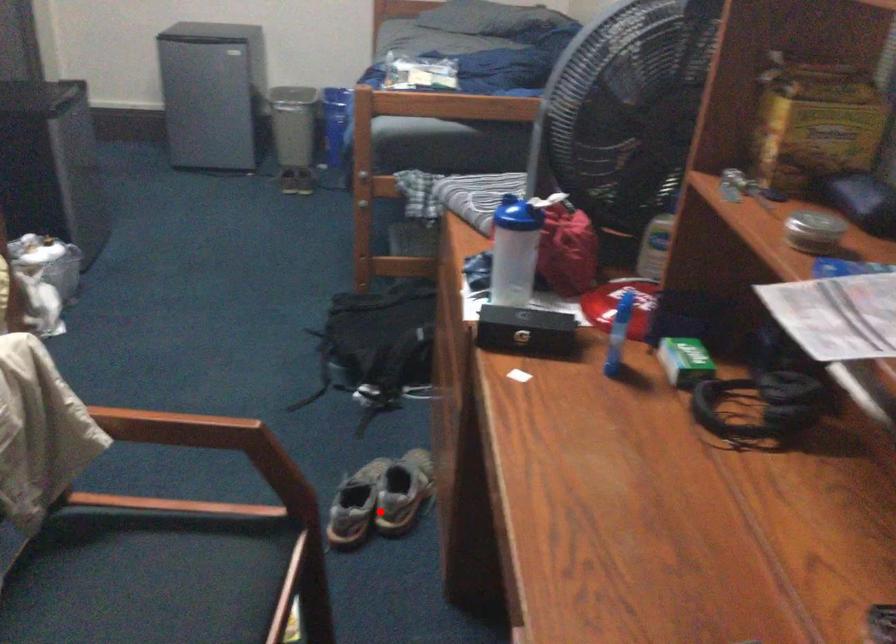
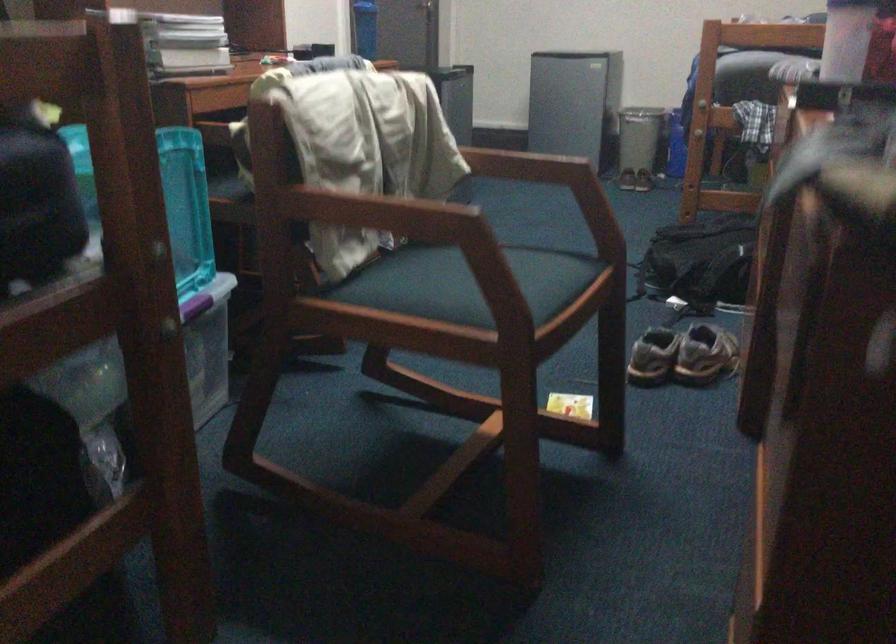
In the second image, find the point that corresponds to the highlighted location in the first image.

(682, 355)